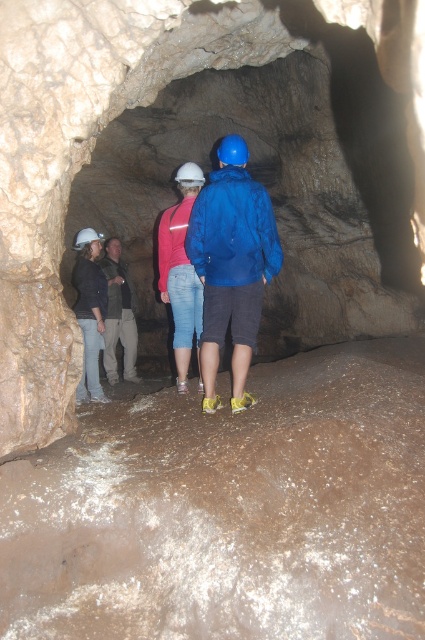
You are a photographer wanting to capture a photo of the blue matte jacket at center and the matte black jacket at left. Based on their sizes, which jacket should you focus on first to ensure it appears larger in the photo?

The blue matte jacket at center is taller than the matte black jacket at left, so focusing on the blue matte jacket at center first will ensure it appears larger in the photo.